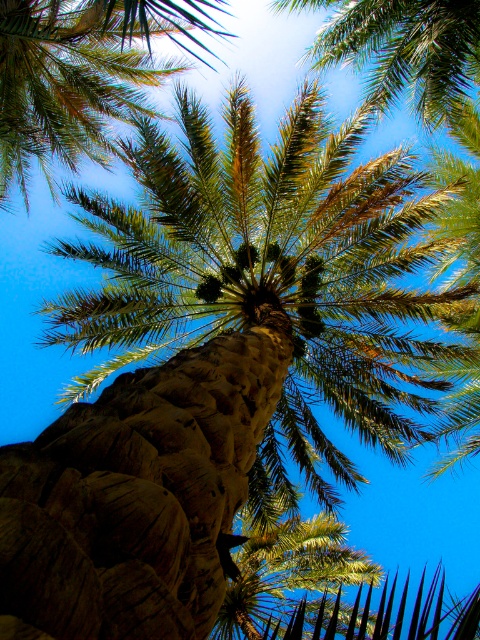
From the picture: You are standing at the base of the palm tree looking upward. There are two points marked on the trunk. One is at coordinate point (60, 92) and the other at point (355, 45). Which point is closer to your current position?

Point (355, 45) is closer to your current position because it is in front of point (60, 92).

You are standing under the palm tree and want to pick a leaf from the green leafy palm at upper center. Which part of the green leafy palm at center should you avoid stepping on to reach the upper one?

The green leafy palm at center is below the green leafy palm at upper center, so you should avoid stepping on the trunk or branches of the green leafy palm at center to reach the green leafy palm at upper center.

Consider the image. You are a bird looking for a place to perch. You see the green leafy palm at center and the green leafy palm at upper center. Which one has a wider trunk for you to rest on?

The green leafy palm at center has a wider trunk than the green leafy palm at upper center, so it is better for perching.